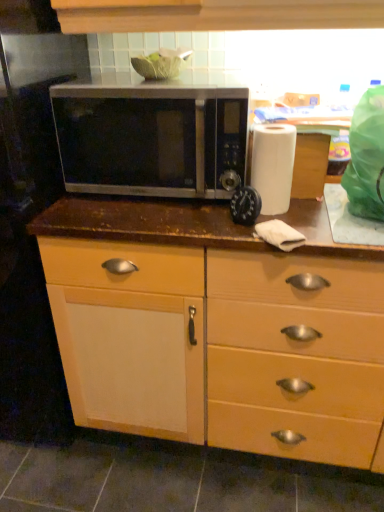
Locate an element on the screen. Image resolution: width=384 pixels, height=512 pixels. vacant region to the left of black plastic timer at center is located at coordinates [189, 219].